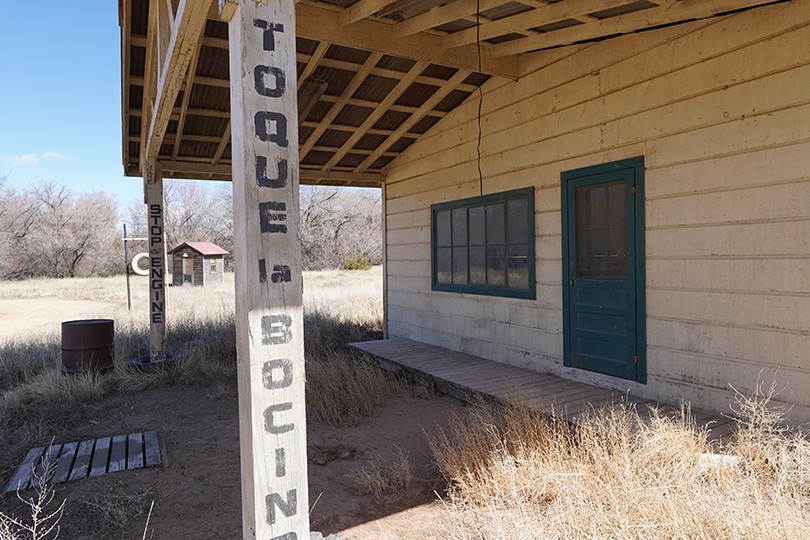
In order to click on hanging black cable in this screenshot , I will do `click(480, 105)`.